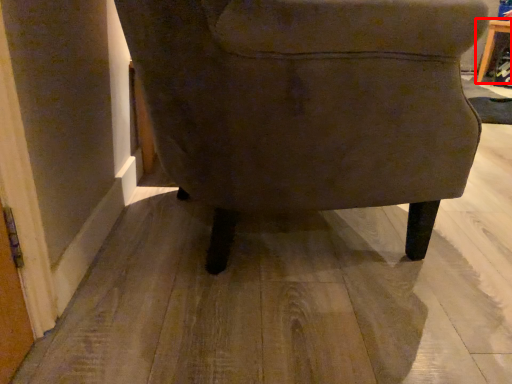
Question: From the image's perspective, where is table (annotated by the red box) located in relation to chair in the image?

Choices:
 (A) below
 (B) above

Answer: (B)